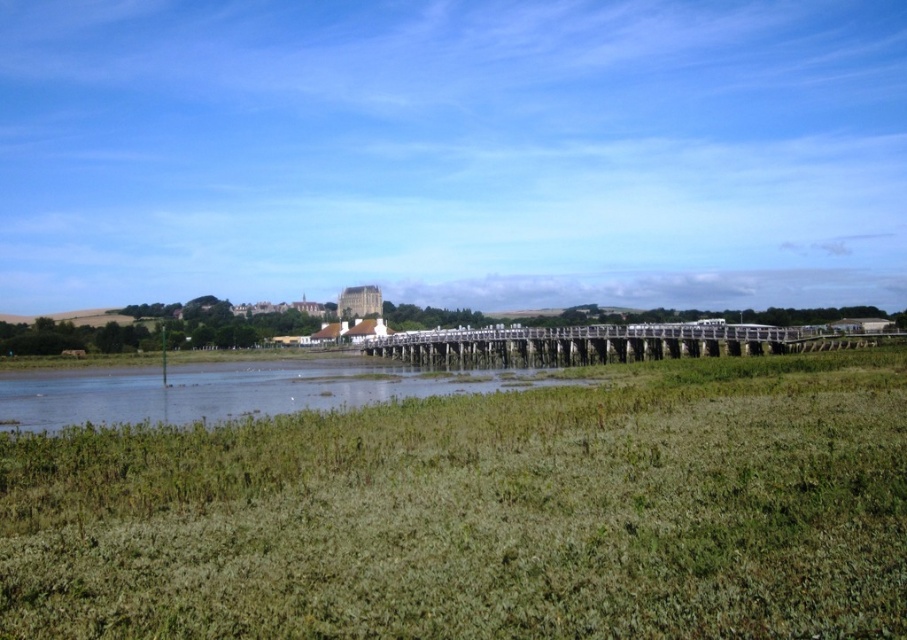
Question: Which object is farther from the camera taking this photo?

Choices:
 (A) wooden bridge at center
 (B) green grassy at center

Answer: (A)

Question: Is green grassy at center smaller than wooden bridge at center?

Choices:
 (A) yes
 (B) no

Answer: (A)

Question: Does green grassy at center come in front of green grassy wetland at lower center?

Choices:
 (A) no
 (B) yes

Answer: (B)

Question: Is green grassy wetland at lower center thinner than wooden bridge at center?

Choices:
 (A) yes
 (B) no

Answer: (B)

Question: Which point is farther to the camera?

Choices:
 (A) wooden bridge at center
 (B) green grassy wetland at lower center

Answer: (A)

Question: Which of the following is the closest to the observer?

Choices:
 (A) (681, 524)
 (B) (86, 394)

Answer: (A)